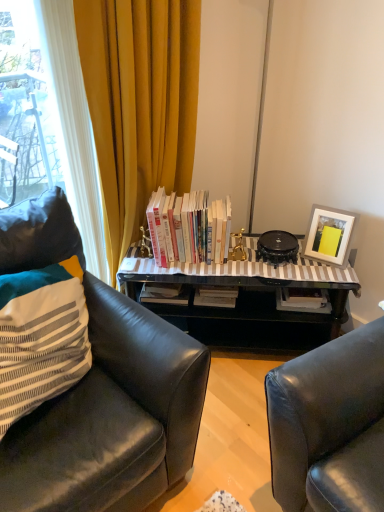
Question: Can you confirm if striped fabric pillow at left is positioned to the left of white matte picture frame at upper right?

Choices:
 (A) no
 (B) yes

Answer: (B)

Question: Is striped fabric pillow at left surrounding white matte picture frame at upper right?

Choices:
 (A) no
 (B) yes

Answer: (A)

Question: Is striped fabric pillow at left facing away from white matte picture frame at upper right?

Choices:
 (A) yes
 (B) no

Answer: (B)

Question: Does striped fabric pillow at left have a lesser height compared to white matte picture frame at upper right?

Choices:
 (A) yes
 (B) no

Answer: (B)

Question: Does striped fabric pillow at left have a greater width compared to white matte picture frame at upper right?

Choices:
 (A) yes
 (B) no

Answer: (A)

Question: From the image's perspective, is striped fabric pillow at left on white matte picture frame at upper right?

Choices:
 (A) no
 (B) yes

Answer: (A)

Question: Is striped fabric pillow at left outside of black leather chair at left?

Choices:
 (A) yes
 (B) no

Answer: (B)

Question: From the image's perspective, does striped fabric pillow at left appear lower than black leather chair at left?

Choices:
 (A) no
 (B) yes

Answer: (A)

Question: Can you see striped fabric pillow at left touching black leather chair at left?

Choices:
 (A) yes
 (B) no

Answer: (B)

Question: Does striped fabric pillow at left appear on the right side of black leather chair at left?

Choices:
 (A) no
 (B) yes

Answer: (A)

Question: Considering the relative sizes of striped fabric pillow at left and black leather chair at left in the image provided, is striped fabric pillow at left taller than black leather chair at left?

Choices:
 (A) no
 (B) yes

Answer: (A)

Question: Is striped fabric pillow at left not close to black leather chair at left?

Choices:
 (A) yes
 (B) no

Answer: (B)

Question: Is white matte picture frame at upper right positioned beyond the bounds of black leather chair at left?

Choices:
 (A) no
 (B) yes

Answer: (B)